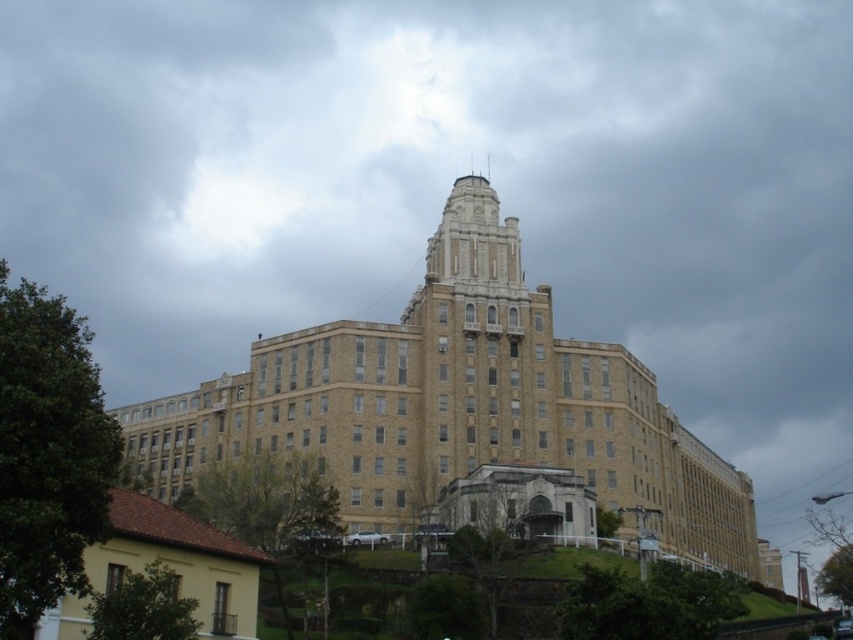
Who is more distant from viewer, (694, 531) or (204, 525)?

Point (694, 531)

Who is positioned more to the left, beige stone building at center or yellow matte house at lower left?

From the viewer's perspective, yellow matte house at lower left appears more on the left side.

Is point (621, 349) positioned after point (245, 593)?

Yes.

At what (x,y) coordinates should I click in order to perform the action: click on beige stone building at center. Please return your answer as a coordinate pair (x, y). This screenshot has height=640, width=853. Looking at the image, I should click on (457, 404).